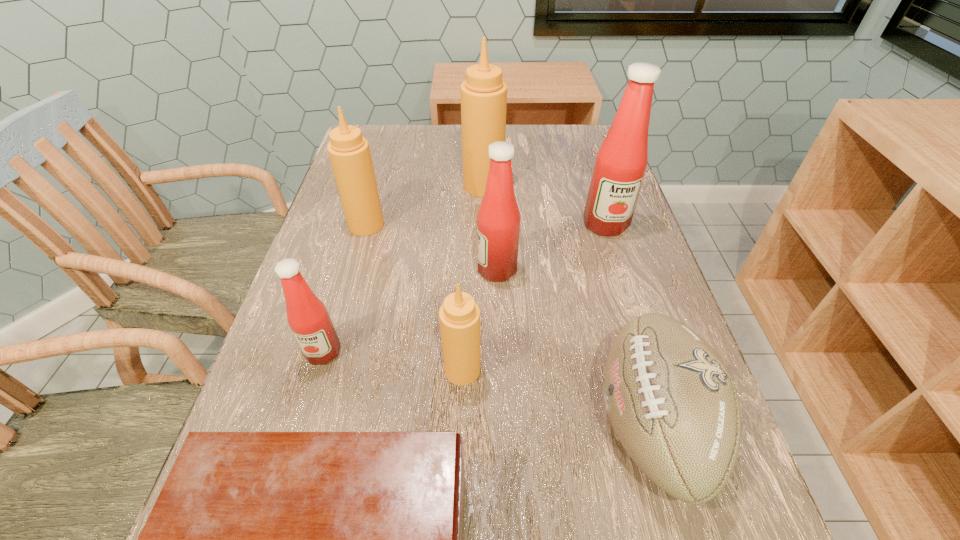
Where is `the leftmost red condiment`? Image resolution: width=960 pixels, height=540 pixels. the leftmost red condiment is located at coordinates (308, 318).

At what (x,y) coordinates should I click in order to perform the action: click on football (American). Please return your answer as a coordinate pair (x, y). The width and height of the screenshot is (960, 540). Looking at the image, I should click on (671, 400).

Image resolution: width=960 pixels, height=540 pixels. Identify the location of free space located on the left of the farthest tan condiment. (338, 185).

At what (x,y) coordinates should I click in order to perform the action: click on vacant space located on the front-facing side of the farthest red condiment. Please return your answer as a coordinate pair (x, y). Looking at the image, I should click on (618, 265).

You are a GUI agent. You are given a task and a screenshot of the screen. Output one action in this format:
    pyautogui.click(x=<x>, y=<y>)
    Task: Click on the free spot located 0.160m on the right of the second smallest tan condiment
    Image resolution: width=960 pixels, height=540 pixels.
    Given the screenshot: What is the action you would take?
    pyautogui.click(x=449, y=225)

Where is `vacant area located 0.100m on the front-facing side of the second smallest red condiment`? The image size is (960, 540). vacant area located 0.100m on the front-facing side of the second smallest red condiment is located at coordinates (432, 270).

Find the location of a particular element. free region located 0.100m on the front-facing side of the second smallest red condiment is located at coordinates 432,270.

The height and width of the screenshot is (540, 960). Find the location of `free spot located on the front-facing side of the second smallest red condiment`. free spot located on the front-facing side of the second smallest red condiment is located at coordinates (400, 270).

Find the location of `free space located 0.270m on the back of the nearest tan condiment`. free space located 0.270m on the back of the nearest tan condiment is located at coordinates (467, 255).

You are a GUI agent. You are given a task and a screenshot of the screen. Output one action in this format:
    pyautogui.click(x=<x>, y=<y>)
    Task: Click on the vacant space located 0.250m on the front-facing side of the leftmost red condiment
    The image size is (960, 540).
    Given the screenshot: What is the action you would take?
    pyautogui.click(x=274, y=518)